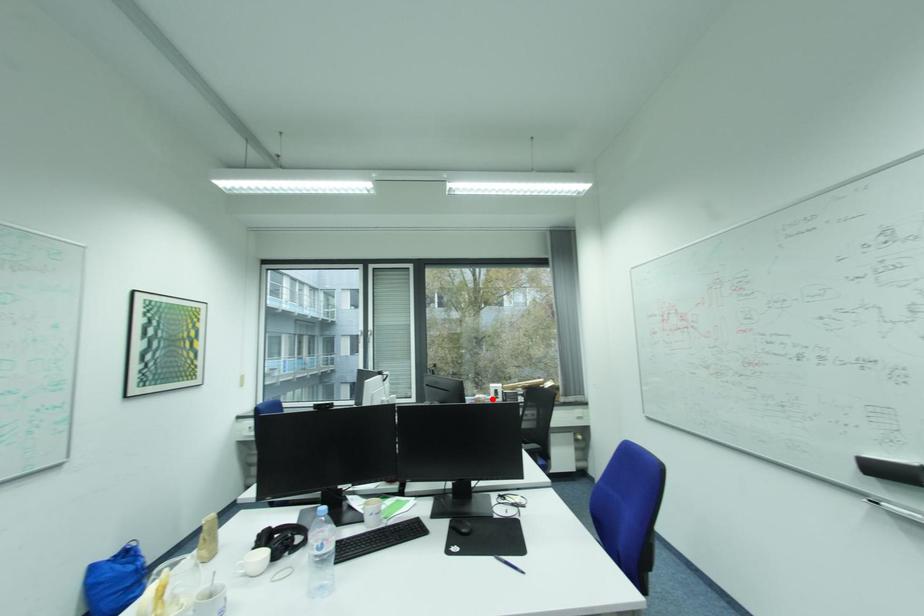
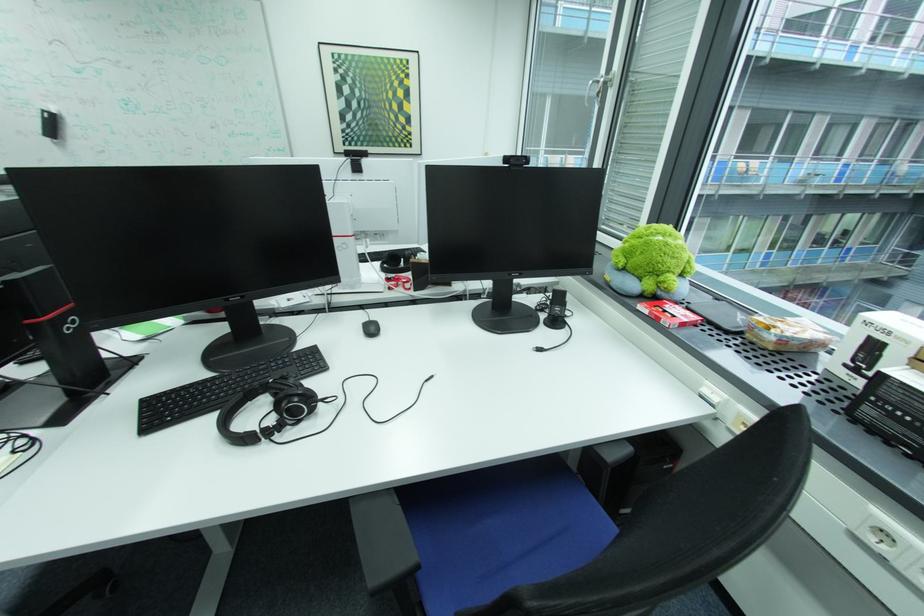
Locate, in the second image, the point that corresponds to the highlighted location in the first image.

(781, 339)